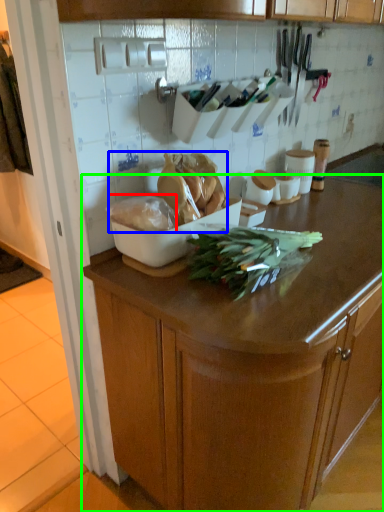
Question: Based on their relative distances, which object is nearer to food (highlighted by a red box)? Choose from food (highlighted by a blue box) and cabinetry (highlighted by a green box).

Choices:
 (A) food
 (B) cabinetry

Answer: (A)